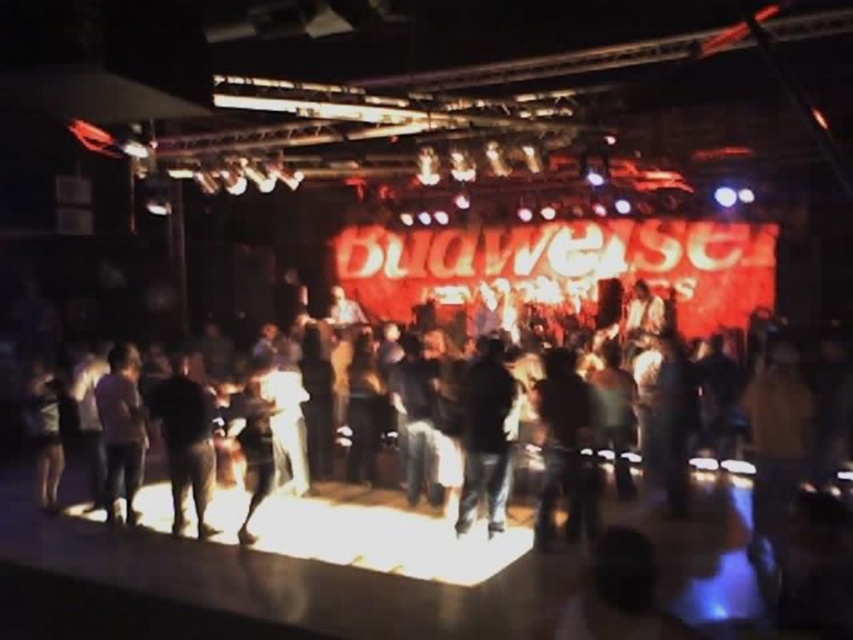
What do you see at coordinates (563, 448) in the screenshot? Image resolution: width=853 pixels, height=640 pixels. I see `dark fabric at center` at bounding box center [563, 448].

This screenshot has width=853, height=640. In order to click on dark fabric at center in this screenshot , I will do `click(563, 448)`.

Between point (563, 454) and point (138, 481), which one is positioned behind?

The point (138, 481) is more distant.

This screenshot has width=853, height=640. I want to click on dark fabric at center, so pyautogui.click(x=563, y=448).

Does dark fabric pants at lower left appear on the left side of dark gray jeans at center?

Indeed, dark fabric pants at lower left is positioned on the left side of dark gray jeans at center.

Is point (178, 483) positioned in front of point (418, 353)?

That is True.

Find the location of a particular element. This screenshot has height=640, width=853. dark fabric pants at lower left is located at coordinates (186, 442).

Does dark blue jeans at center appear on the right side of dark brown leather jacket at center?

No, dark blue jeans at center is not to the right of dark brown leather jacket at center.

Is dark blue jeans at center to the left of dark brown leather jacket at center from the viewer's perspective?

Yes, dark blue jeans at center is to the left of dark brown leather jacket at center.

Which is in front, point (497, 502) or point (612, 404)?

Point (497, 502) is more forward.

Where is `dark blue jeans at center`? The width and height of the screenshot is (853, 640). dark blue jeans at center is located at coordinates (486, 435).